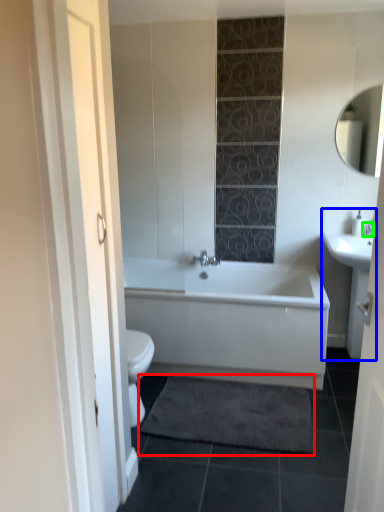
Question: Considering the real-world distances, which object is closest to bath mat (highlighted by a red box)? sink (highlighted by a blue box) or faucet (highlighted by a green box).

Choices:
 (A) sink
 (B) faucet

Answer: (A)